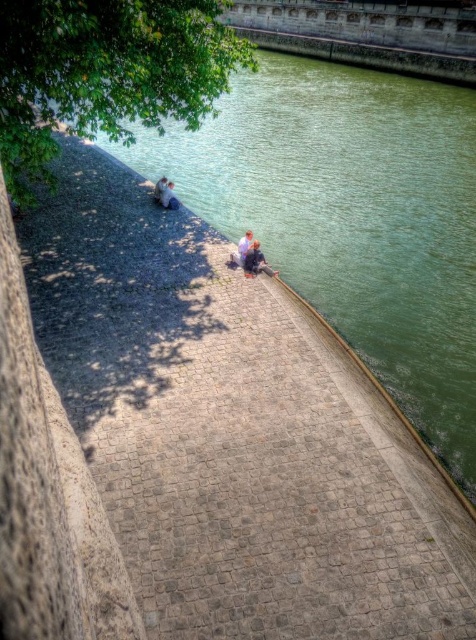
Is green leafy tree at upper left positioned before blue denim jacket at center?

Yes, it is in front of blue denim jacket at center.

Between green leafy tree at upper left and blue denim jacket at center, which one is positioned higher?

green leafy tree at upper left is above.

Measure the distance between point (x=200, y=60) and camera.

They are 50.32 feet apart.

Where is `green leafy tree at upper left`? This screenshot has width=476, height=640. green leafy tree at upper left is located at coordinates (106, 72).

Does green water at lower left appear over smooth skin couple at center?

Correct, green water at lower left is located above smooth skin couple at center.

Is point (469, 264) positioned after point (169, 196)?

That is False.

Identify the location of green water at lower left. Image resolution: width=476 pixels, height=640 pixels. (353, 218).

Does green water at lower left have a larger size compared to blue denim jacket at center?

Yes, green water at lower left is bigger than blue denim jacket at center.

Between point (463, 308) and point (256, 269), which one is positioned behind?

The point (463, 308) is more distant.

At what (x,y) coordinates should I click in order to perform the action: click on green water at lower left. Please return your answer as a coordinate pair (x, y). The image size is (476, 640). Looking at the image, I should click on (353, 218).